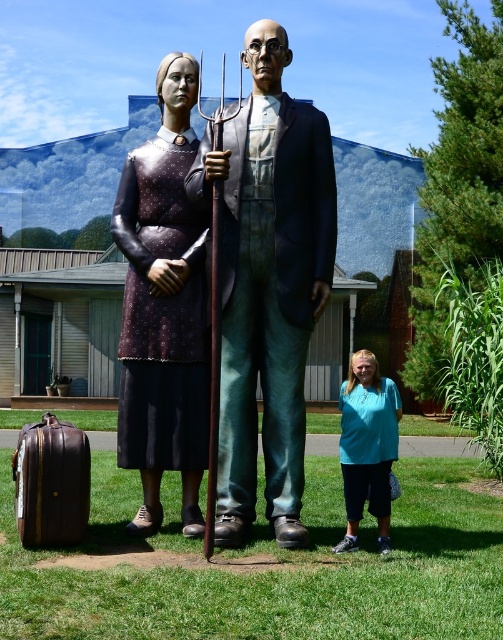
Who is shorter, polished bronze statue at center or brown leather suitcase at lower left?

polished bronze statue at center

Who is positioned more to the right, polished bronze statue at center or brown leather suitcase at lower left?

Positioned to the right is polished bronze statue at center.

Is point (277, 476) farther from viewer compared to point (14, 465)?

No, (277, 476) is closer to viewer.

Identify the location of polished bronze statue at center. (268, 284).

In the scene shown: Between polished bronze statue at center and matte black dress at center, which one appears on the right side from the viewer's perspective?

From the viewer's perspective, polished bronze statue at center appears more on the right side.

Is point (270, 93) in front of point (152, 170)?

Yes, point (270, 93) is closer to viewer.

At what (x,y) coordinates should I click in order to perform the action: click on polished bronze statue at center. Please return your answer as a coordinate pair (x, y). Looking at the image, I should click on (268, 284).

Can you confirm if matte black dress at center is thinner than brown leather suitcase at lower left?

Incorrect, matte black dress at center's width is not less than brown leather suitcase at lower left's.

Who is shorter, matte black dress at center or brown leather suitcase at lower left?

brown leather suitcase at lower left

Between point (186, 300) and point (87, 483), which one is positioned in front?

Point (87, 483) is more forward.

At what (x,y) coordinates should I click in order to perform the action: click on matte black dress at center. Please return your answer as a coordinate pair (x, y). Looking at the image, I should click on (163, 308).